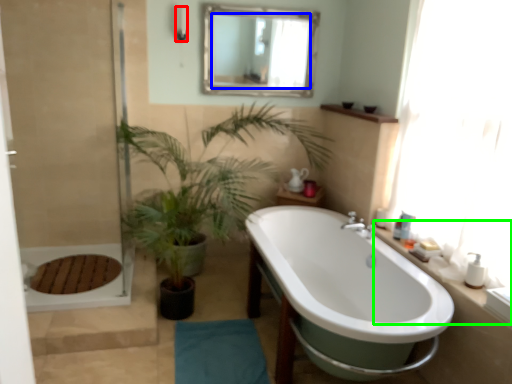
Question: Which object is positioned closest to shower (highlighted by a red box)? Select from mirror (highlighted by a blue box) and counter top (highlighted by a green box).

Choices:
 (A) mirror
 (B) counter top

Answer: (A)